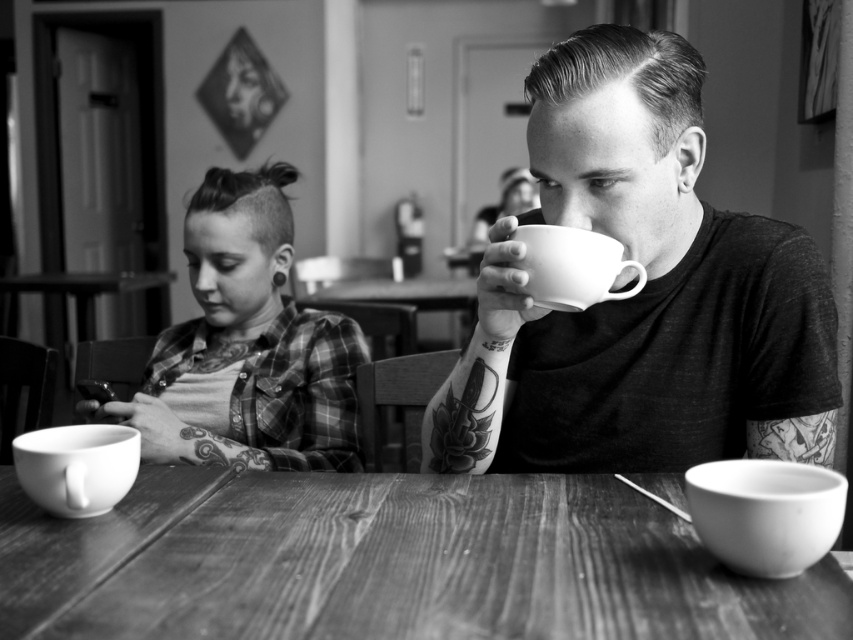
Can you confirm if white ceramic mug at lower right is wider than white ceramic mug at lower left?

No.

Does white ceramic mug at lower right appear on the right side of white ceramic mug at lower left?

Indeed, white ceramic mug at lower right is positioned on the right side of white ceramic mug at lower left.

At what (x,y) coordinates should I click in order to perform the action: click on white ceramic mug at lower right. Please return your answer as a coordinate pair (x, y). This screenshot has width=853, height=640. Looking at the image, I should click on (764, 513).

Image resolution: width=853 pixels, height=640 pixels. Find the location of `white ceramic mug at lower right`. white ceramic mug at lower right is located at coordinates (764, 513).

Does wooden table at center have a greater height compared to matte ceramic cup at center?

No, wooden table at center is not taller than matte ceramic cup at center.

Is wooden table at center shorter than matte ceramic cup at center?

Indeed, wooden table at center has a lesser height compared to matte ceramic cup at center.

Find the location of a particular element. This screenshot has width=853, height=640. wooden table at center is located at coordinates (387, 563).

Can you confirm if white ceramic mug at lower left is smaller than white ceramic mug at upper center?

Indeed, white ceramic mug at lower left has a smaller size compared to white ceramic mug at upper center.

Can you confirm if white ceramic mug at lower left is shorter than white ceramic mug at upper center?

In fact, white ceramic mug at lower left may be taller than white ceramic mug at upper center.

Locate an element on the screen. white ceramic mug at lower left is located at coordinates (77, 467).